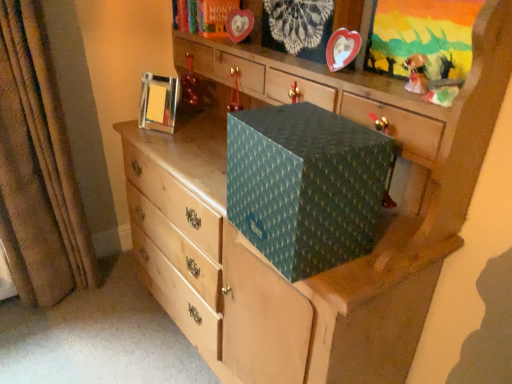
Identify the location of vacant space to the right of brown textured curtain at left. This screenshot has width=512, height=384. (114, 304).